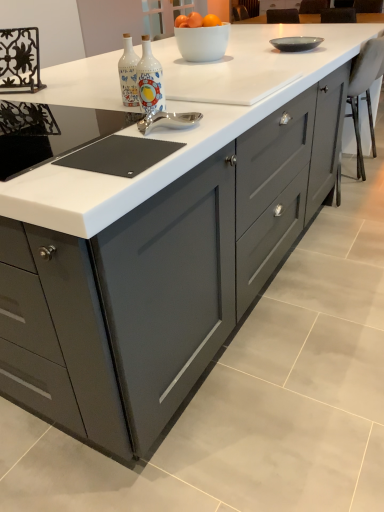
This screenshot has width=384, height=512. Describe the element at coordinates (150, 80) in the screenshot. I see `decorative ceramic bottles at center` at that location.

This screenshot has width=384, height=512. What do you see at coordinates (50, 132) in the screenshot?
I see `black glass gas stove at center` at bounding box center [50, 132].

This screenshot has height=512, width=384. What do you see at coordinates (296, 42) in the screenshot? I see `matte gray bowl at upper right` at bounding box center [296, 42].

Measure the distance between point (209,14) and camera.

The depth of point (209,14) is 6.96 feet.

Where is `decorative ceramic bottles at center`? This screenshot has width=384, height=512. decorative ceramic bottles at center is located at coordinates (150, 80).

Is decorative ceramic bottles at center outside of black glass gas stove at center?

Absolutely, decorative ceramic bottles at center is external to black glass gas stove at center.

Which object is thinner, decorative ceramic bottles at center or black glass gas stove at center?

decorative ceramic bottles at center.

Who is shorter, decorative ceramic bottles at center or black glass gas stove at center?

black glass gas stove at center.

Is orange matte at upper center positioned with its back to decorative ceramic bottles at center?

That's right, orange matte at upper center is facing away from decorative ceramic bottles at center.

How distant is orange matte at upper center from decorative ceramic bottles at center?

orange matte at upper center and decorative ceramic bottles at center are 79.42 centimeters apart from each other.

Can you tell me how much orange matte at upper center and decorative ceramic bottles at center differ in facing direction?

The angular difference between orange matte at upper center and decorative ceramic bottles at center is 0.0401 degrees.

Which is correct: orange matte at upper center is inside decorative ceramic bottles at center, or outside of it?

orange matte at upper center is not inside decorative ceramic bottles at center, it's outside.

Is matte gray bowl at upper right positioned behind decorative ceramic bottles at center?

Yes, it is behind decorative ceramic bottles at center.

In order to click on bottle below the matte gray bowl at upper right (from the image's perspective) in this screenshot , I will do `click(150, 80)`.

Is decorative ceramic bottles at center inside matte gray bowl at upper right?

No, decorative ceramic bottles at center is not inside matte gray bowl at upper right.

Who is shorter, matte gray bowl at upper right or decorative ceramic bottles at center?

Standing shorter between the two is matte gray bowl at upper right.

In terms of height, does black glass gas stove at center look taller or shorter compared to matte gray bowl at upper right?

Considering their sizes, black glass gas stove at center has less height than matte gray bowl at upper right.

Is black glass gas stove at center thinner than matte gray bowl at upper right?

No.

This screenshot has width=384, height=512. In the image, there is a matte gray bowl at upper right. Identify the location of gas stove below it (from the image's perspective). (50, 132).

Considering the points (51, 106) and (308, 37), which point is behind, point (51, 106) or point (308, 37)?

The point (308, 37) is farther from the camera.

From a real-world perspective, who is located lower, orange matte at upper center or white fabric chair at right?

In real-world perspective, white fabric chair at right is lower.

Is point (209, 20) farther from camera compared to point (372, 61)?

That is False.

Which of these two, orange matte at upper center or white fabric chair at right, stands taller?

white fabric chair at right is taller.

Is white fabric chair at right at the back of orange matte at upper center?

No.

Is matte gray bowl at upper right to the right of orange matte at upper center from the viewer's perspective?

Correct, you'll find matte gray bowl at upper right to the right of orange matte at upper center.

Which of these two, matte gray bowl at upper right or orange matte at upper center, is bigger?

matte gray bowl at upper right is bigger.

Can you see matte gray bowl at upper right touching orange matte at upper center?

matte gray bowl at upper right and orange matte at upper center are clearly separated.

Considering the positions of point (157, 74) and point (300, 48), is point (157, 74) closer or farther from the camera than point (300, 48)?

Point (157, 74) appears to be closer to the viewer than point (300, 48).

Is decorative ceramic bottles at center oriented towards matte gray bowl at upper right?

Yes, decorative ceramic bottles at center faces towards matte gray bowl at upper right.

Considering the sizes of decorative ceramic bottles at center and matte gray bowl at upper right in the image, is decorative ceramic bottles at center wider or thinner than matte gray bowl at upper right?

Considering their sizes, decorative ceramic bottles at center looks slimmer than matte gray bowl at upper right.

Between decorative ceramic bottles at center and matte gray bowl at upper right, which one has more height?

With more height is decorative ceramic bottles at center.

Where is `bottle above the black glass gas stove at center (from a real-world perspective)`? The height and width of the screenshot is (512, 384). bottle above the black glass gas stove at center (from a real-world perspective) is located at coordinates (150, 80).

At what (x,y) coordinates should I click in order to perform the action: click on bottle directly beneath the orange matte at upper center (from a real-world perspective). Please return your answer as a coordinate pair (x, y). Looking at the image, I should click on (150, 80).

Based on their spatial positions, is decorative ceramic bottles at center or black glass gas stove at center further from white fabric chair at right?

The object further to white fabric chair at right is black glass gas stove at center.

From the image, which object appears to be nearer to decorative ceramic bottles at center, black glass gas stove at center or matte gray bowl at upper right?

Among the two, black glass gas stove at center is located nearer to decorative ceramic bottles at center.

Looking at the image, which one is located closer to matte gray bowl at upper right, black glass gas stove at center or white fabric chair at right?

The object closer to matte gray bowl at upper right is white fabric chair at right.

When comparing their distances from black glass gas stove at center, does white fabric chair at right or matte gray bowl at upper right seem further?

Based on the image, white fabric chair at right appears to be further to black glass gas stove at center.

Based on their spatial positions, is orange matte at upper center or black glass gas stove at center further from white fabric chair at right?

black glass gas stove at center is positioned further to the anchor white fabric chair at right.

Looking at the image, which one is located closer to black glass gas stove at center, decorative ceramic bottles at center or orange matte at upper center?

The object closer to black glass gas stove at center is decorative ceramic bottles at center.

Looking at the image, which one is located further to matte gray bowl at upper right, decorative ceramic bottles at center or black glass gas stove at center?

black glass gas stove at center.

Estimate the real-world distances between objects in this image. Which object is further from orange matte at upper center, matte gray bowl at upper right or black glass gas stove at center?

black glass gas stove at center is positioned further to the anchor orange matte at upper center.

You are a GUI agent. You are given a task and a screenshot of the screen. Output one action in this format:
    pyautogui.click(x=<x>, y=<y>)
    Task: Click on the bowl located between decorative ceramic bottles at center and white fabric chair at right in the depth direction
    The height and width of the screenshot is (512, 384).
    Given the screenshot: What is the action you would take?
    pyautogui.click(x=296, y=42)

At what (x,y) coordinates should I click in order to perform the action: click on bowl located between black glass gas stove at center and white fabric chair at right in the left-right direction. Please return your answer as a coordinate pair (x, y). The height and width of the screenshot is (512, 384). Looking at the image, I should click on (296, 42).

Identify the location of orange between black glass gas stove at center and white fabric chair at right from left to right. This screenshot has width=384, height=512. (211, 21).

Locate an element on the screen. The height and width of the screenshot is (512, 384). bottle between black glass gas stove at center and white fabric chair at right from left to right is located at coordinates (150, 80).